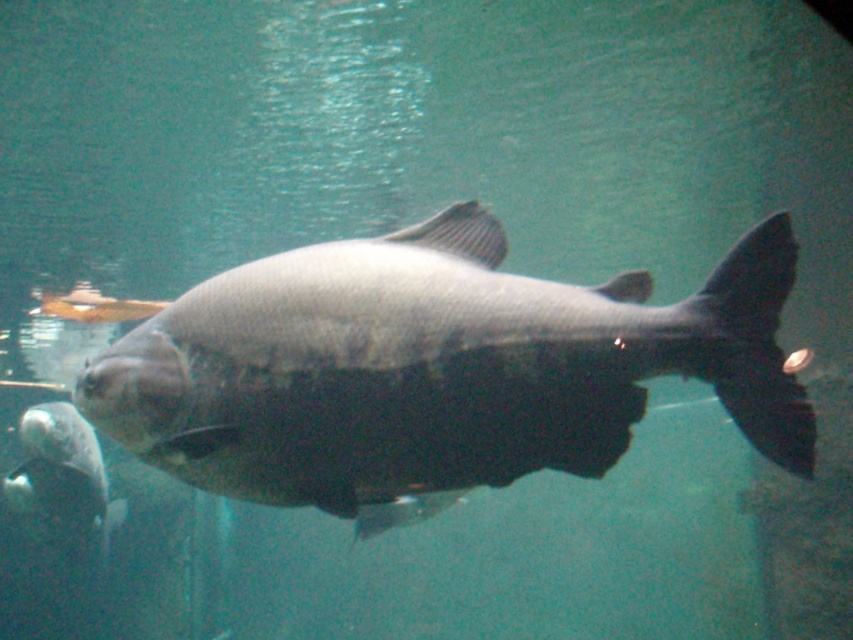
You are an underwater photographer trying to capture both the shiny silver fish at center and the shiny silver fish at lower left in a single frame. Which fish should you focus on first to ensure they both fit in the shot?

The shiny silver fish at center is smaller than the shiny silver fish at lower left. To ensure both fit in the shot, focus on the shiny silver fish at lower left first as it is larger and requires more space.

You are an underwater photographer aiming to capture both the shiny silver fish at center and the shiny silver fish at lower left in a single frame. Which fish should you focus on first to ensure both are in the frame?

The shiny silver fish at center is shorter than the shiny silver fish at lower left, so you should focus on the shiny silver fish at lower left first to ensure both are in the frame since it is larger and might require more space.

You are an underwater photographer trying to capture both the shiny silver fish at center and the shiny silver fish at lower left in a single frame. Based on their positions, which fish would appear larger in your camera viewfinder?

The shiny silver fish at center would appear larger in the camera viewfinder because it is wider than the shiny silver fish at lower left according to their sizes.